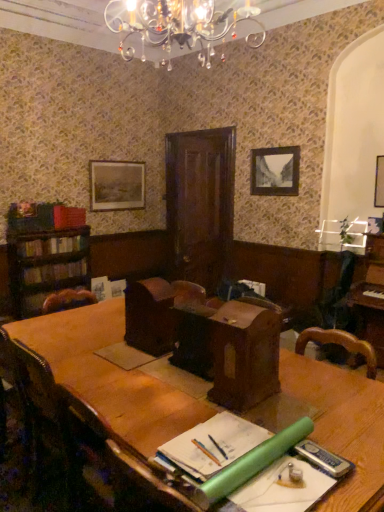
In order to click on free point to the right of wooden desk at center in this screenshot , I will do `click(308, 398)`.